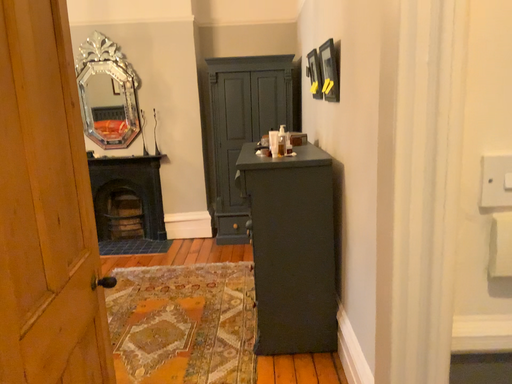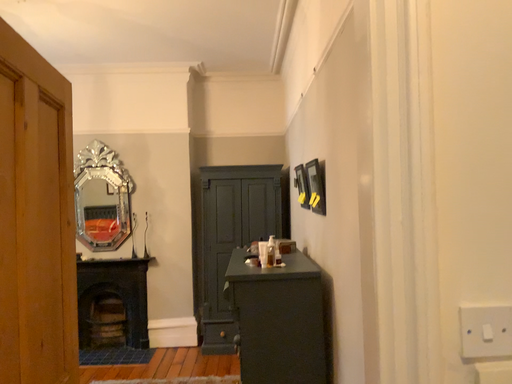
Question: How did the camera likely rotate when shooting the video?

Choices:
 (A) rotated downward
 (B) rotated upward

Answer: (B)